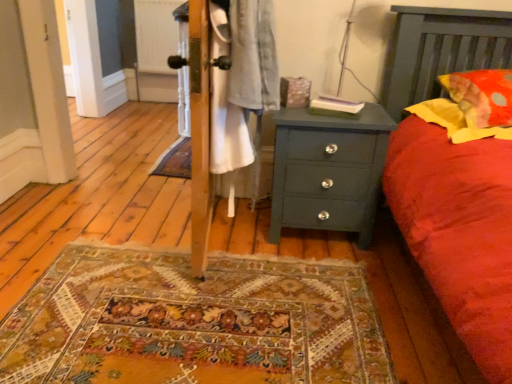
Question: Looking at their shapes, would you say white wood screen door at left is wider or thinner than yellow fabric pillow at right, arranged as the first pillow when viewed from the top?

Choices:
 (A) thin
 (B) wide

Answer: (A)

Question: Is white wood screen door at left situated inside yellow fabric pillow at right, which appears as the second pillow when ordered from the bottom, or outside?

Choices:
 (A) inside
 (B) outside

Answer: (B)

Question: Which object is positioned farthest from the yellow fabric pillow at right, arranged as the first pillow when viewed from the top?

Choices:
 (A) soft yellow fabric pillow at right, the second pillow viewed from the top
 (B) teal painted wood chest of drawers at center
 (C) white wood screen door at left

Answer: (C)

Question: Which object is the closest to the soft yellow fabric pillow at right, marked as the 1th pillow in a bottom-to-top arrangement?

Choices:
 (A) white wood screen door at left
 (B) teal painted wood chest of drawers at center
 (C) yellow fabric pillow at right, arranged as the first pillow when viewed from the top

Answer: (C)